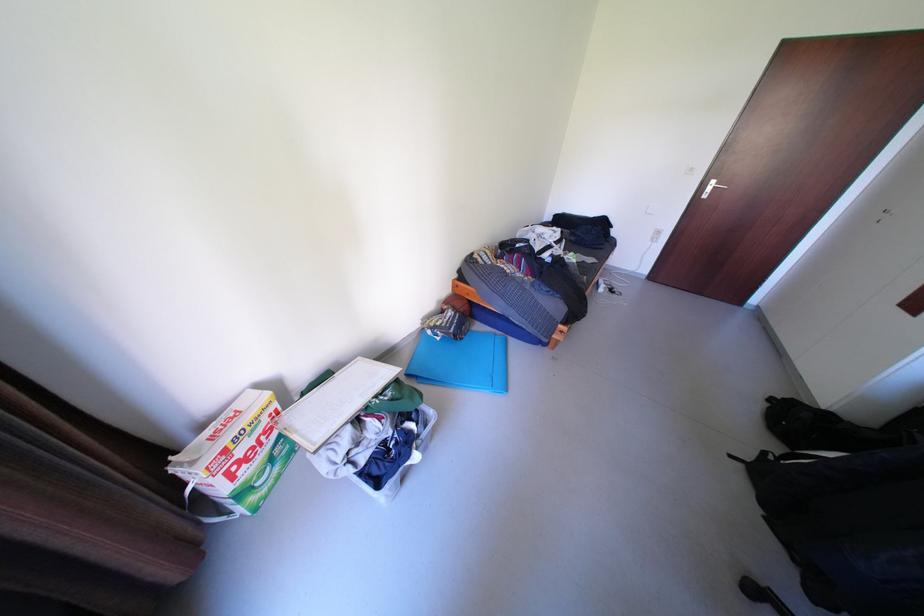
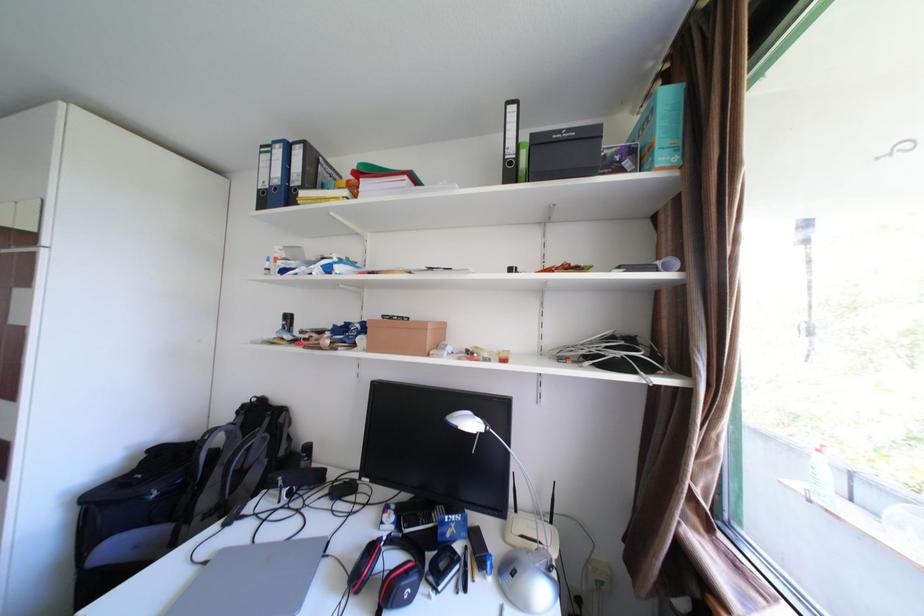
Question: How did the camera likely rotate?

Choices:
 (A) Left
 (B) Right
 (C) Up
 (D) Down

Answer: (B)